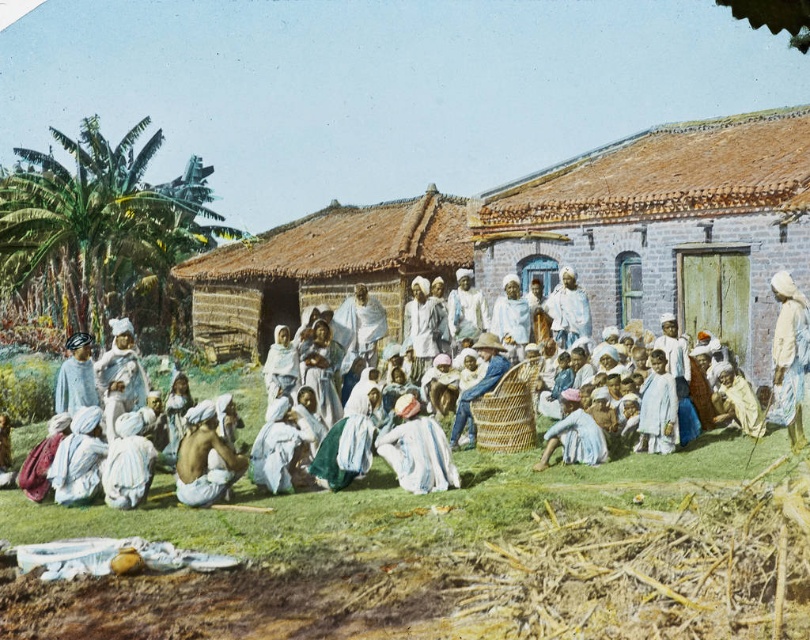
Does brick textured hut at center appear on the left side of brown thatched hut at center?

Incorrect, brick textured hut at center is not on the left side of brown thatched hut at center.

Based on the photo, between brick textured hut at center and brown thatched hut at center, which one has more height?

brick textured hut at center is taller.

Between point (702, 138) and point (391, 323), which one is positioned behind?

The point (702, 138) is behind.

The width and height of the screenshot is (810, 640). Find the location of `brick textured hut at center`. brick textured hut at center is located at coordinates (664, 227).

From the picture: Does brick textured hut at center have a lesser width compared to white cotton turban at center?

Yes.

Locate an element on the screen. The image size is (810, 640). brick textured hut at center is located at coordinates click(664, 227).

Is brown thatched hut at center below light blue fabric at center?

Incorrect, brown thatched hut at center is not positioned below light blue fabric at center.

What do you see at coordinates (322, 268) in the screenshot?
I see `brown thatched hut at center` at bounding box center [322, 268].

Where is `brown thatched hut at center`? This screenshot has height=640, width=810. brown thatched hut at center is located at coordinates (322, 268).

Find the location of a particular element. This screenshot has height=640, width=810. brown thatched hut at center is located at coordinates (322, 268).